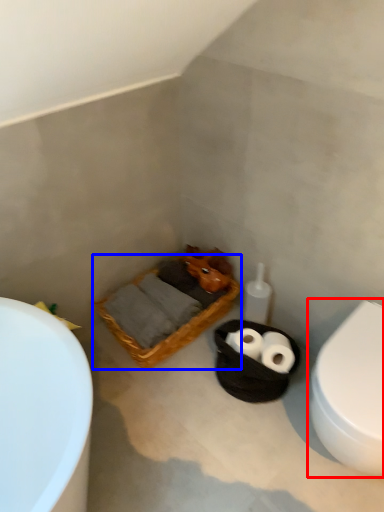
Question: Among these objects, which one is nearest to the camera, toilet (highlighted by a red box) or basket (highlighted by a blue box)?

Choices:
 (A) toilet
 (B) basket

Answer: (A)